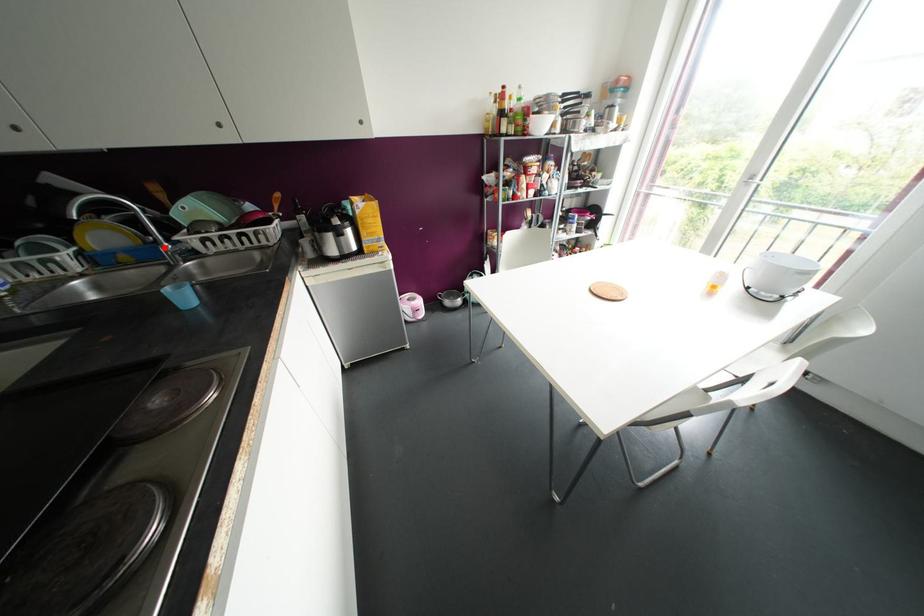
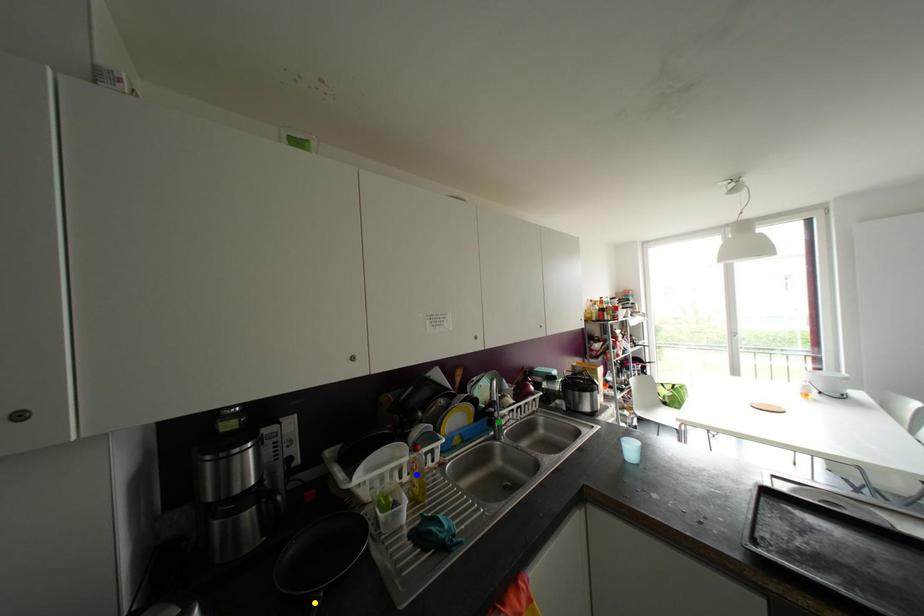
Question: I am providing you with two images of the same scene from different viewpoints. A red point is marked on the first image. You are given multiple points on the second image. In image 2, which mark is for the same physical point as the one in image 1?

Choices:
 (A) yellow point
 (B) blue point
 (C) green point

Answer: (C)